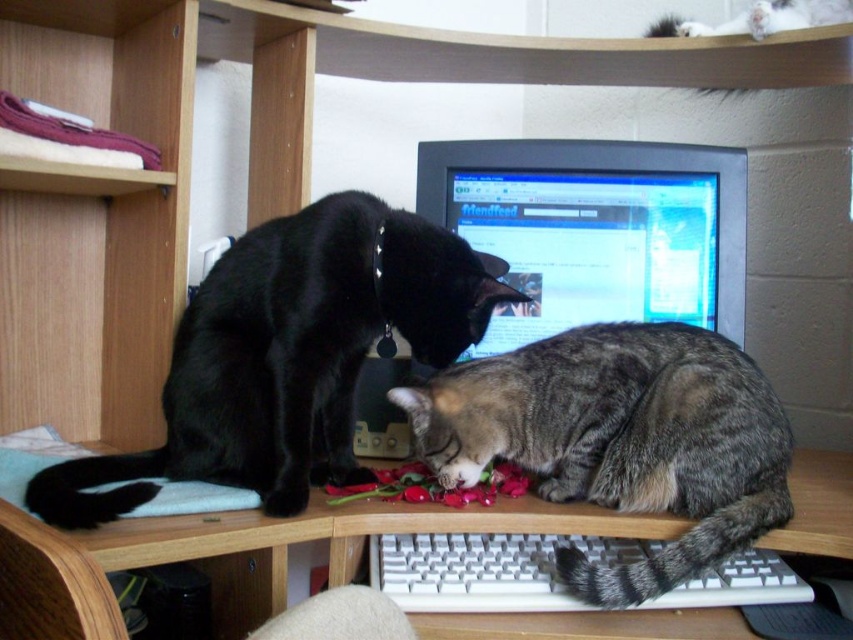
Measure the distance from shiny black cat at center to tabby fur cat at lower center.

A distance of 8.38 inches exists between shiny black cat at center and tabby fur cat at lower center.

Based on the photo, who is higher up, shiny black cat at center or tabby fur cat at lower center?

shiny black cat at center is above.

Is point (370, 260) positioned behind point (415, 396)?

No, (370, 260) is closer to viewer.

In order to click on shiny black cat at center in this screenshot , I will do `click(289, 355)`.

Does tabby fur cat at lower center appear on the right side of matte black monitor at center?

No, tabby fur cat at lower center is not to the right of matte black monitor at center.

At what (x,y) coordinates should I click in order to perform the action: click on tabby fur cat at lower center. Please return your answer as a coordinate pair (x, y). Looking at the image, I should click on (619, 440).

Between matte black monitor at center and wooden table at center, which one appears on the right side from the viewer's perspective?

matte black monitor at center

Is matte black monitor at center wider than wooden table at center?

No, matte black monitor at center is not wider than wooden table at center.

Who is more forward, [466,179] or [262,547]?

Point [262,547]

Where is `matte black monitor at center`? matte black monitor at center is located at coordinates (596, 228).